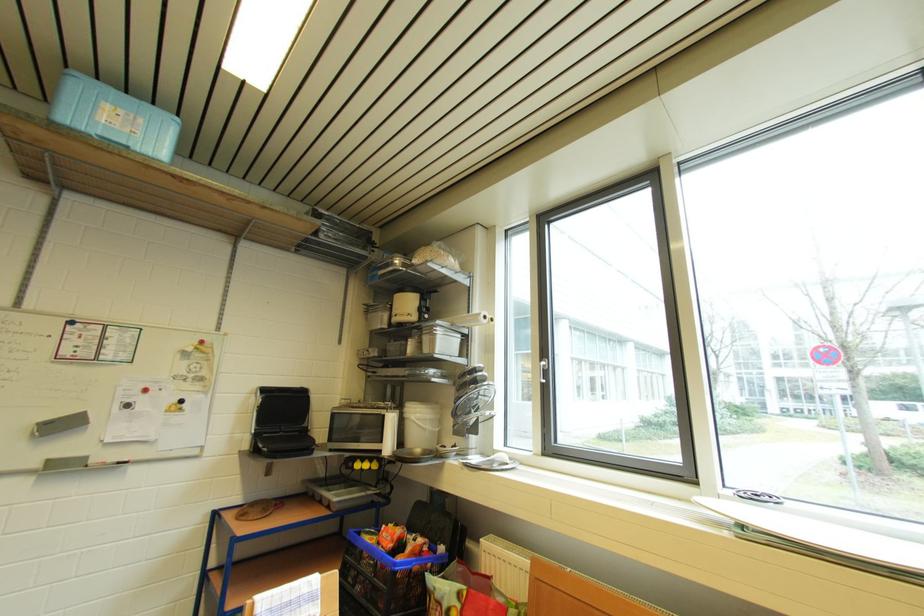
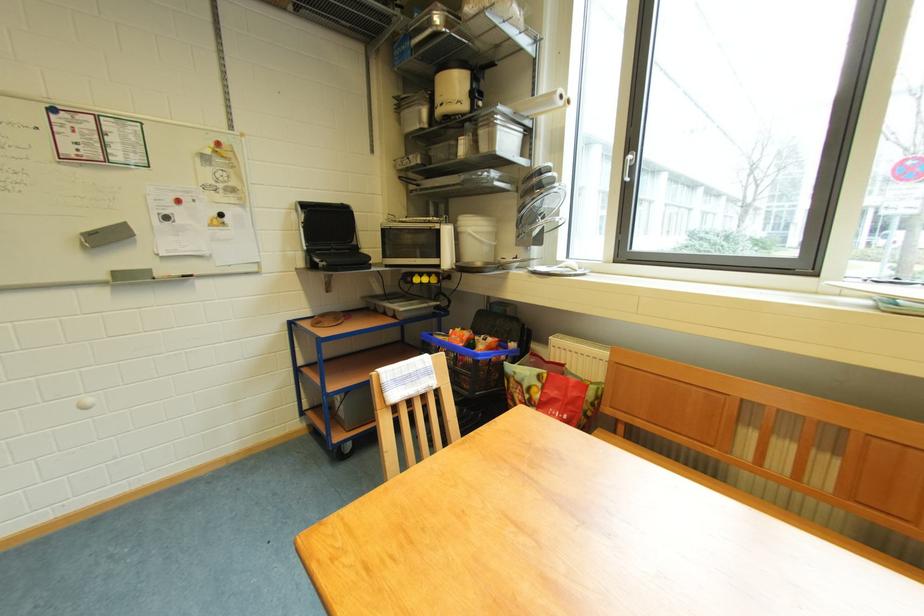
Locate, in the second image, the point that corresponds to pixel 358 468 in the first image.

(417, 282)